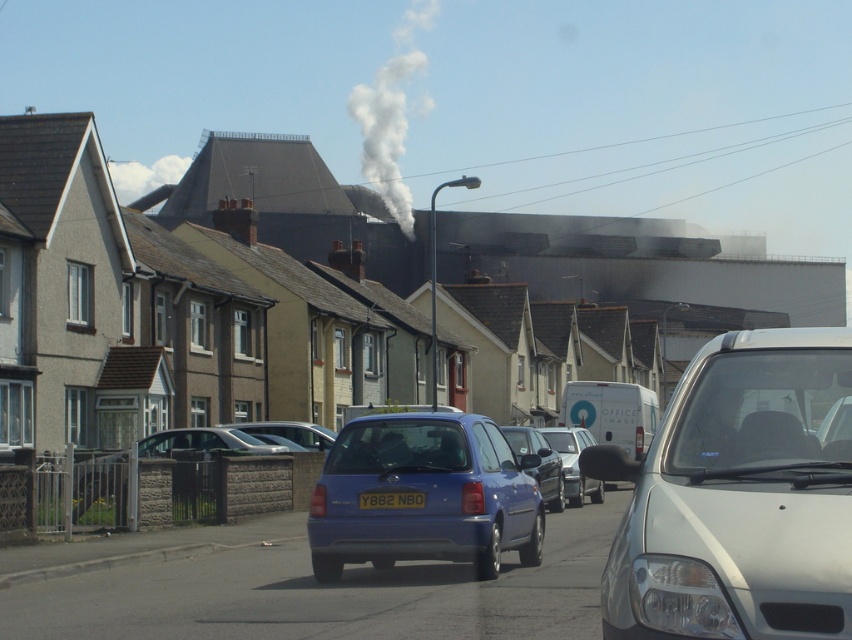
You are standing at the point marked by the coordinates point (x=424, y=496) in the image. What object are you standing on?

You are standing on the matte blue hatchback at center, as the point (x=424, y=496) marks this object in the image.

You are a pedestrian standing at the side of the road. You see the white smoke at center and the matte blue car at center. Which one appears bigger to you?

The white smoke at center is larger in size than the matte blue car at center, so the white smoke at center appears bigger.

You are a pedestrian standing on the sidewalk near the residential street scene. You see the white smoke at center and the matte blue car at center. How far apart are these two objects from each other?

The white smoke at center and the matte blue car at center are 126.69 meters apart from each other.